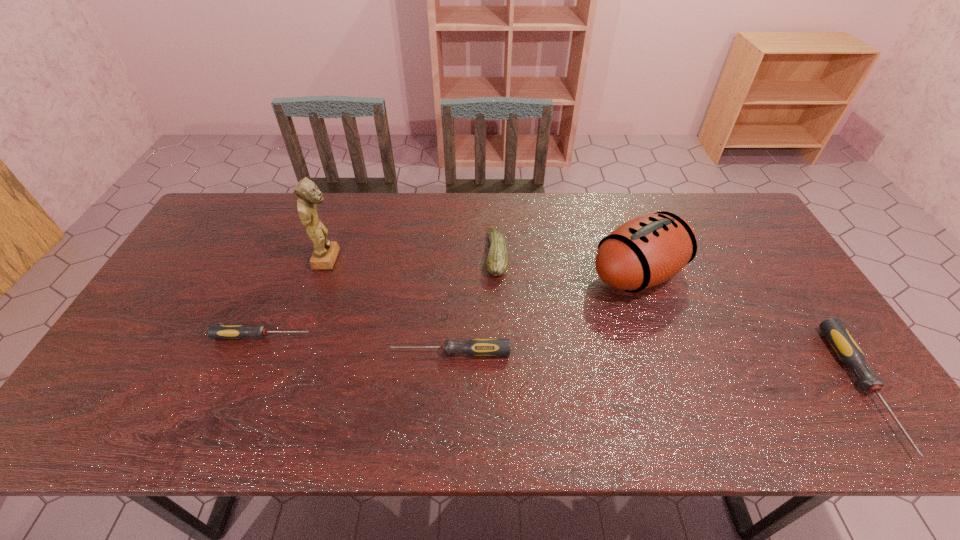
Find the location of a particular element. This screenshot has height=540, width=960. object situated at the right edge is located at coordinates (845, 346).

You are a GUI agent. You are given a task and a screenshot of the screen. Output one action in this format:
    pyautogui.click(x=<x>, y=<y>)
    Task: Click on the object positioned at the near right corner
    This screenshot has height=540, width=960.
    Given the screenshot: What is the action you would take?
    pyautogui.click(x=845, y=346)

Identify the location of vacant area at the far edge of the desktop. The height and width of the screenshot is (540, 960). (406, 216).

In the image, there is a desktop. At what (x,y) coordinates should I click in order to perform the action: click on vacant space at the near edge. Please return your answer as a coordinate pair (x, y). Image resolution: width=960 pixels, height=540 pixels. Looking at the image, I should click on (193, 372).

Identify the location of vacant space at the right edge. The height and width of the screenshot is (540, 960). (783, 316).

Identify the location of vacant space at the far left corner. (244, 207).

What are the coordinates of `vacant space at the near left corner of the desktop` in the screenshot? It's located at (101, 384).

This screenshot has width=960, height=540. I want to click on unoccupied area between the figurine and the football (American), so click(483, 266).

Where is `free spot between the fourth shortest object and the shortest object`? Image resolution: width=960 pixels, height=540 pixels. free spot between the fourth shortest object and the shortest object is located at coordinates (379, 295).

I want to click on unoccupied position between the zucchini and the second screwdriver from right to left, so click(x=473, y=303).